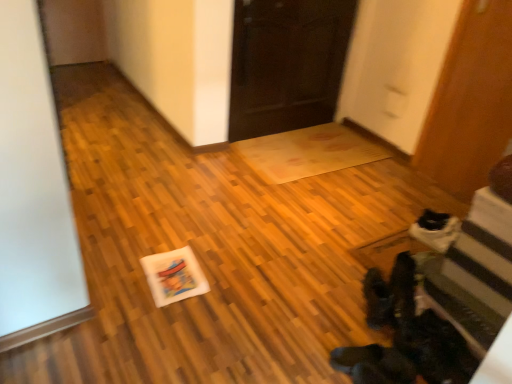
Question: In terms of size, does white matte postcard at center appear bigger or smaller than wooden door at right, which ranks as the second door in left-to-right order?

Choices:
 (A) big
 (B) small

Answer: (B)

Question: In terms of width, does white matte postcard at center look wider or thinner when compared to wooden door at right, which appears as the 1th door when viewed from the right?

Choices:
 (A) thin
 (B) wide

Answer: (B)

Question: Which object is the closest to the dark wood door at center, placed as the 2th door when sorted from right to left?

Choices:
 (A) white matte postcard at center
 (B) black suede boots at lower right
 (C) wooden door at right, which appears as the 1th door when viewed from the right

Answer: (C)

Question: Which is farther from the dark wood door at center, placed as the 2th door when sorted from right to left?

Choices:
 (A) white matte postcard at center
 (B) wooden door at right, which ranks as the second door in left-to-right order
 (C) black suede boots at lower right

Answer: (C)